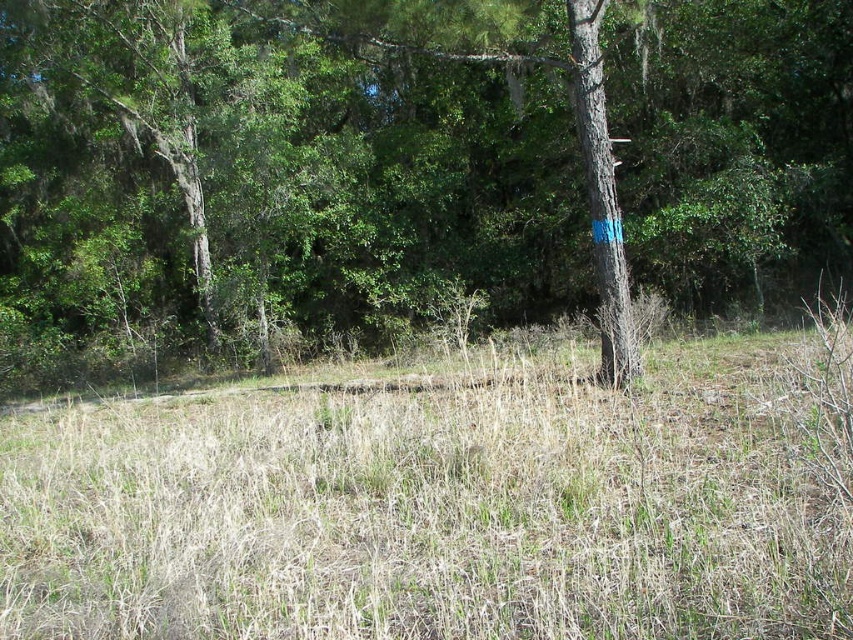
You are a park ranger navigating a wooded area. You need to locate the green rough bark tree at center. According to the map coordinates, where should you look?

The green rough bark tree at center is located at point (413, 163).

You are a park ranger assessing the health of the forest. You notice the green rough bark tree at center and the dry grass at center. Which of these two has a greater width?

The green rough bark tree at center has a greater width than the dry grass at center, as stated in the description.